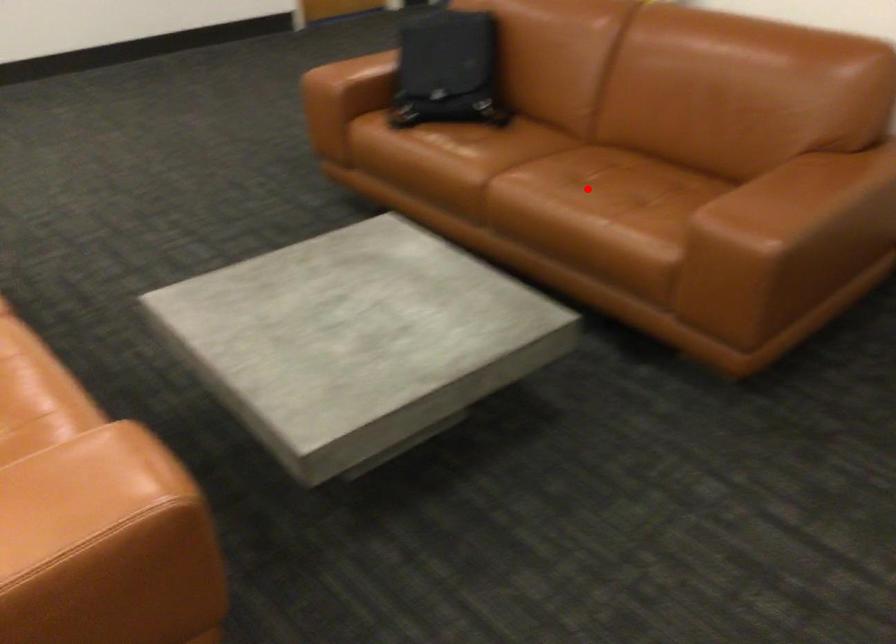
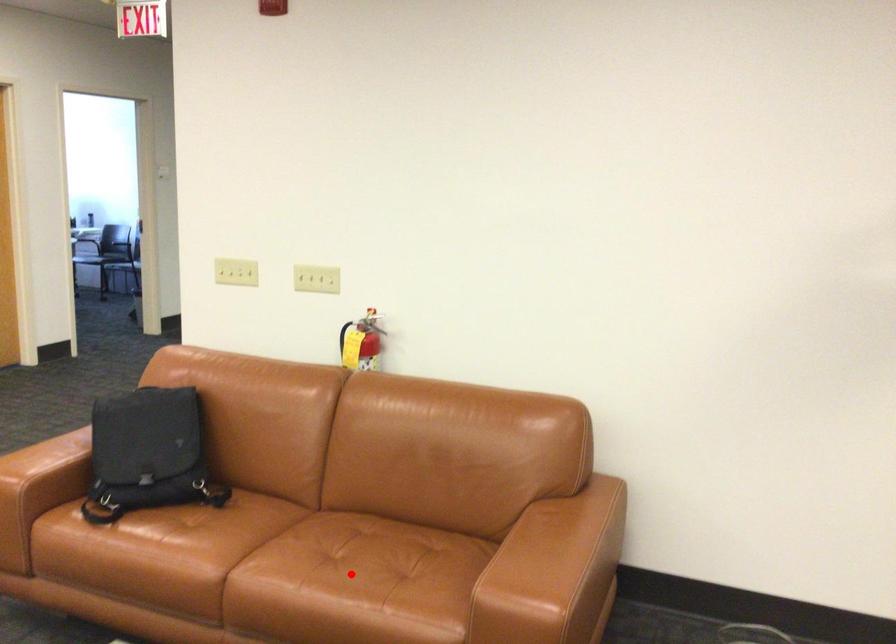
I am providing you with two images of the same scene from different viewpoints. A red point is marked on the first image and another point is marked on the second image. Does the point marked in image1 correspond to the same location as the one in image2?

Yes